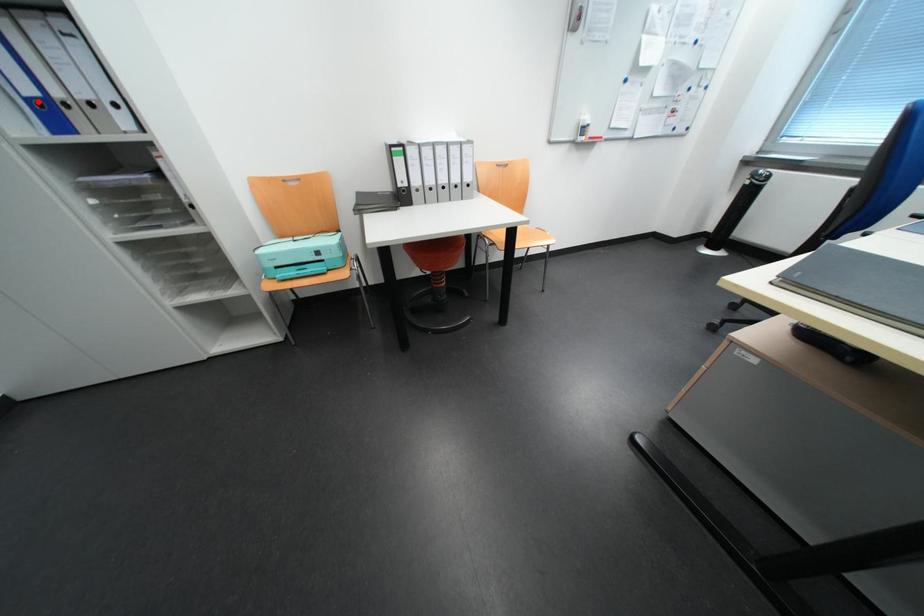
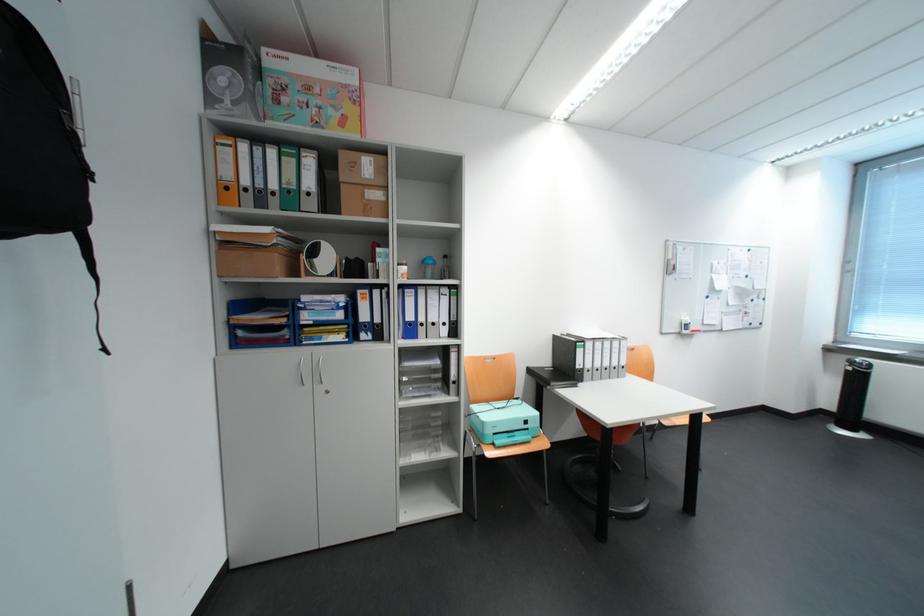
Where in the second image is the point corresponding to the highlighted location from the first image?

(417, 323)